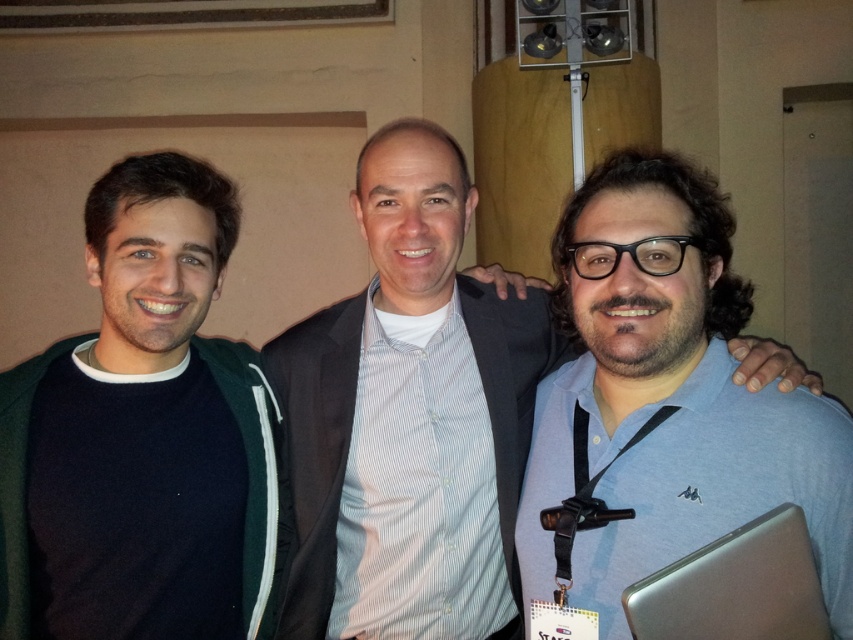
Question: Which object appears closest to the camera in this image?

Choices:
 (A) blue striped shirt at center
 (B) silver metallic laptop at lower right
 (C) dark green sweater at left
 (D) blue fabric shirt at right

Answer: (B)

Question: Can you confirm if blue fabric shirt at right is positioned below silver metallic laptop at lower right?

Choices:
 (A) no
 (B) yes

Answer: (A)

Question: Is dark green sweater at left in front of blue striped shirt at center?

Choices:
 (A) no
 (B) yes

Answer: (B)

Question: Is blue fabric shirt at right wider than blue striped shirt at center?

Choices:
 (A) yes
 (B) no

Answer: (B)

Question: Estimate the real-world distances between objects in this image. Which object is farther from the silver metallic laptop at lower right?

Choices:
 (A) blue fabric shirt at right
 (B) blue striped shirt at center

Answer: (B)

Question: Considering the real-world distances, which object is farthest from the blue fabric shirt at right?

Choices:
 (A) silver metallic laptop at lower right
 (B) dark green sweater at left
 (C) blue striped shirt at center

Answer: (B)